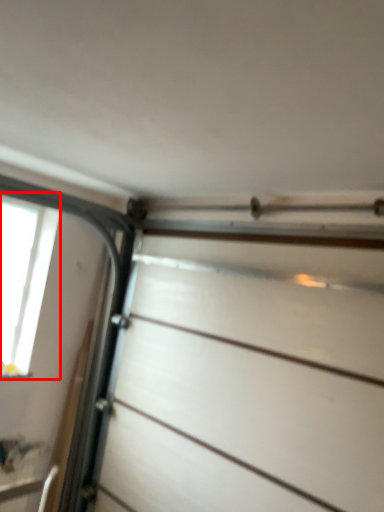
Question: Where is window (annotated by the red box) located in relation to drawer in the image?

Choices:
 (A) right
 (B) left

Answer: (B)